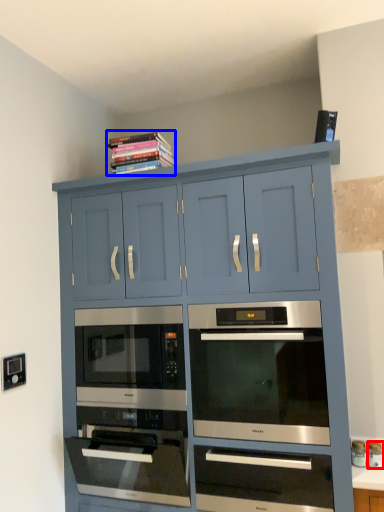
Question: Which object appears closest to the camera in this image, appliance (highlighted by a red box) or book (highlighted by a blue box)?

Choices:
 (A) appliance
 (B) book

Answer: (A)